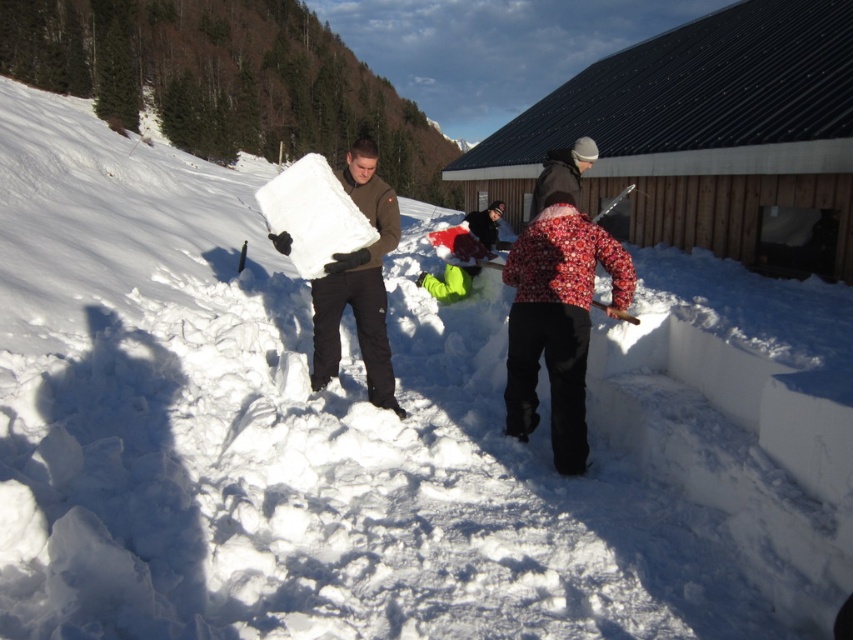
You are standing at the origin of the coordinate system and looking towards the image. Which of the two points, point (561, 228) or point (575, 166), is closer to you?

Point (561, 228) is in front of point (575, 166), so it is closer to you.